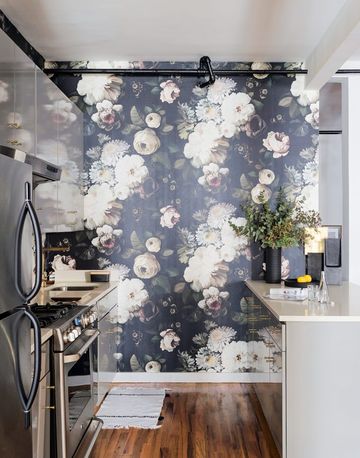
Where is `handle of refrigerator`? Image resolution: width=360 pixels, height=458 pixels. handle of refrigerator is located at coordinates (37, 253).